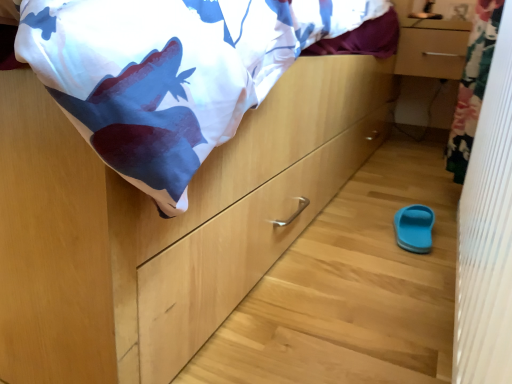
Question: From the image's perspective, is white textured curtain at right below blue rubber slipper at lower right?

Choices:
 (A) no
 (B) yes

Answer: (A)

Question: Does white textured curtain at right have a lesser width compared to blue rubber slipper at lower right?

Choices:
 (A) no
 (B) yes

Answer: (A)

Question: Can you confirm if white textured curtain at right is bigger than blue rubber slipper at lower right?

Choices:
 (A) yes
 (B) no

Answer: (A)

Question: Is white textured curtain at right located outside blue rubber slipper at lower right?

Choices:
 (A) no
 (B) yes

Answer: (B)

Question: Is white textured curtain at right facing away from blue rubber slipper at lower right?

Choices:
 (A) no
 (B) yes

Answer: (A)

Question: Is blue rubber slipper at lower right taller or shorter than white textured curtain at right?

Choices:
 (A) short
 (B) tall

Answer: (A)

Question: Based on their sizes in the image, would you say blue rubber slipper at lower right is bigger or smaller than white textured curtain at right?

Choices:
 (A) small
 (B) big

Answer: (A)

Question: From a real-world perspective, relative to white textured curtain at right, is blue rubber slipper at lower right vertically above or below?

Choices:
 (A) above
 (B) below

Answer: (B)

Question: Is blue rubber slipper at lower right wider or thinner than white textured curtain at right?

Choices:
 (A) thin
 (B) wide

Answer: (A)

Question: Is white textured curtain at right in front of or behind matte wood drawer at upper right in the image?

Choices:
 (A) front
 (B) behind

Answer: (A)

Question: Considering the positions of point pyautogui.click(x=508, y=269) and point pyautogui.click(x=444, y=43), is point pyautogui.click(x=508, y=269) closer or farther from the camera than point pyautogui.click(x=444, y=43)?

Choices:
 (A) closer
 (B) farther

Answer: (A)

Question: Based on their positions, is white textured curtain at right located to the left or right of matte wood drawer at upper right?

Choices:
 (A) left
 (B) right

Answer: (A)

Question: From the image's perspective, is white textured curtain at right above or below matte wood drawer at upper right?

Choices:
 (A) below
 (B) above

Answer: (A)

Question: From a real-world perspective, relative to white textured curtain at right, is matte wood drawer at upper right vertically above or below?

Choices:
 (A) above
 (B) below

Answer: (A)

Question: Considering the positions of point (413, 66) and point (508, 0), is point (413, 66) closer or farther from the camera than point (508, 0)?

Choices:
 (A) farther
 (B) closer

Answer: (A)